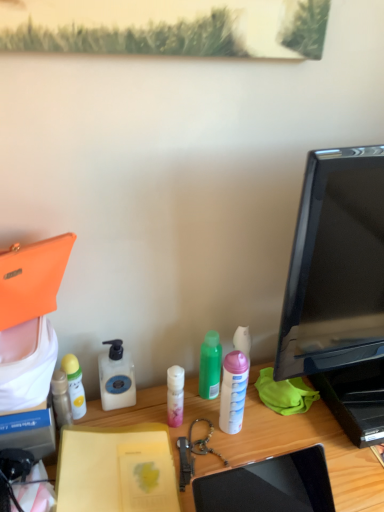
Image resolution: width=384 pixels, height=512 pixels. In order to click on vacant space situated on the left part of green matte bottle at center, placed as the fourth bottle when sorted from left to right in this screenshot , I will do `click(150, 403)`.